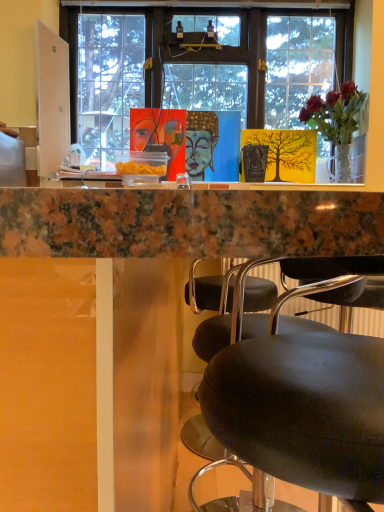
Question: Is marble countertop at upper center turned away from translucent glass vase at upper right?

Choices:
 (A) yes
 (B) no

Answer: (B)

Question: Is marble countertop at upper center thinner than translucent glass vase at upper right?

Choices:
 (A) yes
 (B) no

Answer: (B)

Question: Is marble countertop at upper center to the left of translucent glass vase at upper right from the viewer's perspective?

Choices:
 (A) yes
 (B) no

Answer: (A)

Question: Can you confirm if marble countertop at upper center is shorter than translucent glass vase at upper right?

Choices:
 (A) yes
 (B) no

Answer: (B)

Question: Is marble countertop at upper center to the right of translucent glass vase at upper right from the viewer's perspective?

Choices:
 (A) yes
 (B) no

Answer: (B)

Question: From the image's perspective, is marble countertop at upper center over translucent glass vase at upper right?

Choices:
 (A) no
 (B) yes

Answer: (A)

Question: Does translucent glass vase at upper right turn towards marble countertop at upper center?

Choices:
 (A) yes
 (B) no

Answer: (B)

Question: Is translucent glass vase at upper right taller than marble countertop at upper center?

Choices:
 (A) no
 (B) yes

Answer: (A)

Question: Can you confirm if translucent glass vase at upper right is shorter than marble countertop at upper center?

Choices:
 (A) no
 (B) yes

Answer: (B)

Question: From a real-world perspective, is translucent glass vase at upper right positioned under marble countertop at upper center based on gravity?

Choices:
 (A) no
 (B) yes

Answer: (A)

Question: Is translucent glass vase at upper right positioned far away from marble countertop at upper center?

Choices:
 (A) yes
 (B) no

Answer: (A)

Question: Is translucent glass vase at upper right thinner than marble countertop at upper center?

Choices:
 (A) yes
 (B) no

Answer: (A)

Question: Is translucent glass vase at upper right to the left or to the right of marble countertop at upper center in the image?

Choices:
 (A) left
 (B) right

Answer: (B)